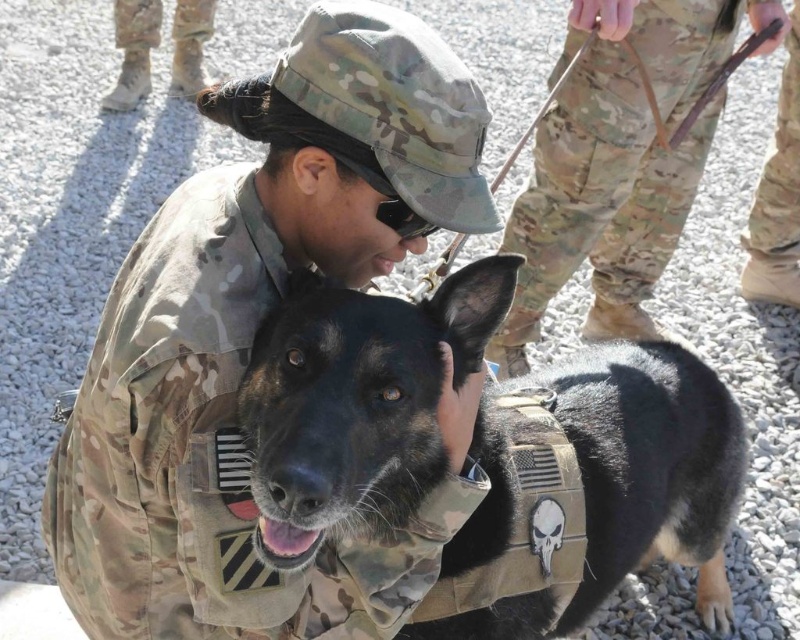
You are a photographer trying to capture a closeup of the camouflage uniform at center without the camouflage boots at lower left appearing in the frame. Based on their positions, is this possible?

The camouflage uniform at center is in front of the camouflage boots at lower left, so it is possible to capture a closeup of the camouflage uniform at center without the camouflage boots at lower left appearing in the frame.

You are a photographer trying to capture the soldier and the dog in the image. You notice that the camouflage uniform at center and camouflage pants at center are part of the same outfit. Which one is positioned lower on the soldier?

The camouflage uniform at center is positioned lower than the camouflage pants at center because it is described as being below it.

What is the 2D coordinate of the camouflage uniform at center?

The 2D coordinate of the camouflage uniform at center is at point (252,340).